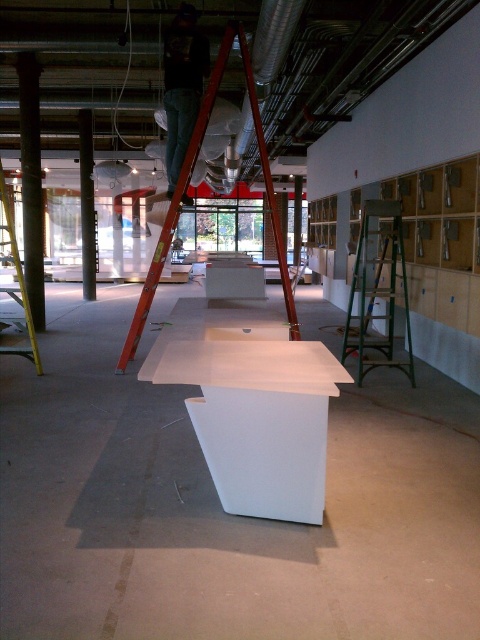
Question: Is metallic red ladder at upper center below yellow metallic ladder at left?

Choices:
 (A) no
 (B) yes

Answer: (A)

Question: Observing the image, what is the correct spatial positioning of metallic red ladder at upper center in reference to yellow metallic ladder at left?

Choices:
 (A) below
 (B) above

Answer: (B)

Question: Which object is the farthest from the yellow metallic ladder at left?

Choices:
 (A) green metal ladder at right
 (B) white glossy table at center
 (C) metallic red ladder at upper center

Answer: (A)

Question: Considering the relative positions of green metal ladder at right and smooth concrete column at left in the image provided, where is green metal ladder at right located with respect to smooth concrete column at left?

Choices:
 (A) right
 (B) left

Answer: (A)

Question: Which point is farther to the camera?

Choices:
 (A) smooth concrete pillar at left
 (B) metallic red ladder at upper center
 (C) white glossy table at center

Answer: (A)

Question: Among these points, which one is nearest to the camera?

Choices:
 (A) (288, 506)
 (B) (236, 291)
 (C) (20, 147)

Answer: (A)